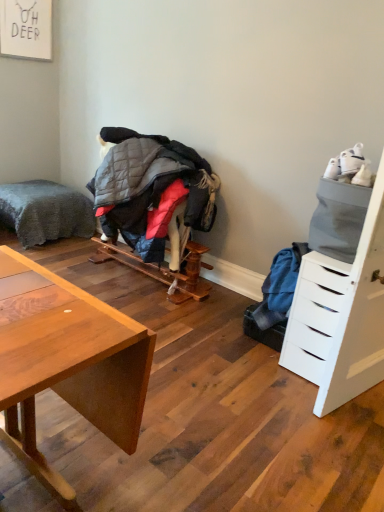
Question: Looking at their shapes, would you say quilted gray jacket at center is wider or thinner than gray plush bed at left?

Choices:
 (A) thin
 (B) wide

Answer: (A)

Question: Would you say quilted gray jacket at center is inside or outside gray plush bed at left?

Choices:
 (A) outside
 (B) inside

Answer: (A)

Question: Which object is positioned closest to the quilted gray jacket at center?

Choices:
 (A) gray plush bed at left
 (B) white matte drawer at right

Answer: (A)

Question: Considering the real-world distances, which object is farthest from the gray plush bed at left?

Choices:
 (A) white matte drawer at right
 (B) quilted gray jacket at center

Answer: (A)